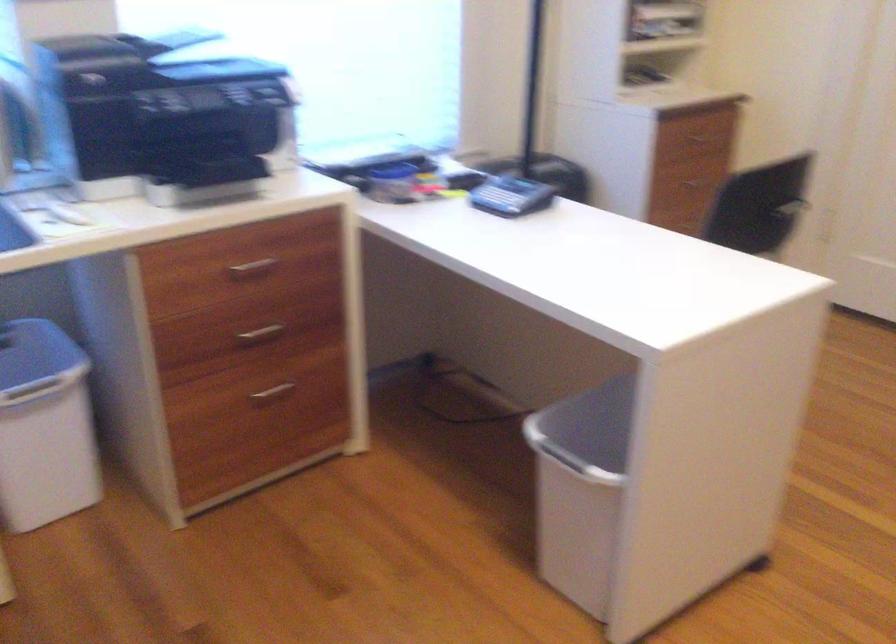
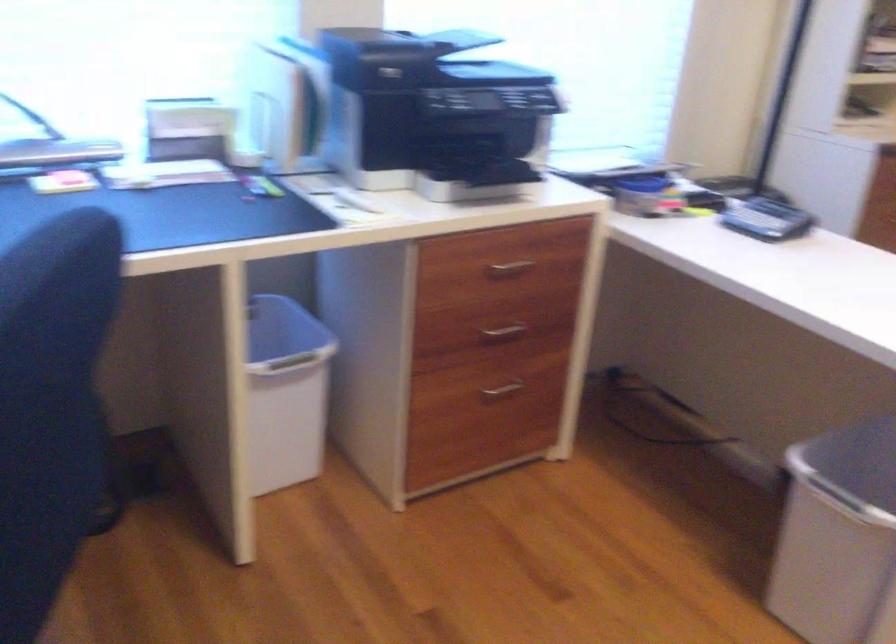
Locate, in the second image, the point that corresponds to pixel 510 196 in the first image.

(767, 220)